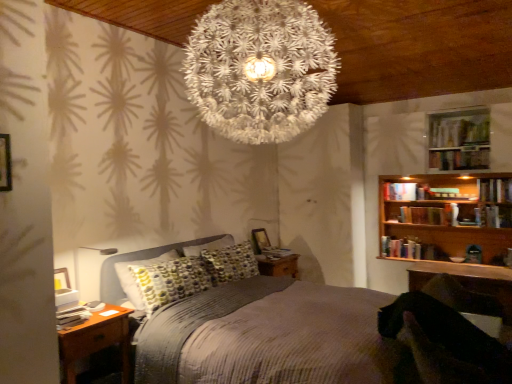
Question: Is brown wood nightstand at lower left positioned with its back to hardcover book at upper right, the first book when ordered from top to bottom?

Choices:
 (A) no
 (B) yes

Answer: (A)

Question: From the image's perspective, is brown wood nightstand at lower left under hardcover book at upper right, the first book when ordered from top to bottom?

Choices:
 (A) yes
 (B) no

Answer: (A)

Question: Considering the relative sizes of brown wood nightstand at lower left and hardcover book at upper right, the sixth book in the bottom-to-top sequence, in the image provided, is brown wood nightstand at lower left bigger than hardcover book at upper right, the sixth book in the bottom-to-top sequence,?

Choices:
 (A) yes
 (B) no

Answer: (A)

Question: From the image's perspective, would you say brown wood nightstand at lower left is positioned over hardcover book at upper right, the sixth book in the bottom-to-top sequence?

Choices:
 (A) yes
 (B) no

Answer: (B)

Question: Is brown wood nightstand at lower left positioned far away from hardcover book at upper right, the 5th book when ordered from left to right?

Choices:
 (A) yes
 (B) no

Answer: (A)

Question: Does point (499, 188) appear closer or farther from the camera than point (461, 157)?

Choices:
 (A) farther
 (B) closer

Answer: (A)

Question: From the image's perspective, is hardcover book at upper right, which is the first book from right to left, above or below hardcover book at upper right, the first book when ordered from top to bottom?

Choices:
 (A) above
 (B) below

Answer: (B)

Question: In terms of width, does hardcover book at upper right, the second book positioned from the top, look wider or thinner when compared to hardcover book at upper right, the 5th book when ordered from left to right?

Choices:
 (A) thin
 (B) wide

Answer: (B)

Question: From a real-world perspective, is hardcover book at upper right, which is the first book from right to left, above or below hardcover book at upper right, the first book when ordered from top to bottom?

Choices:
 (A) above
 (B) below

Answer: (B)

Question: Relative to hardcover book at center, which appears as the sixth book when viewed from the top, is hardcover books at right, which is the second book from bottom to top, in front or behind?

Choices:
 (A) front
 (B) behind

Answer: (B)

Question: From a real-world perspective, is hardcover books at right, marked as the fourth book in a right-to-left arrangement, above or below hardcover book at center, which ranks as the sixth book in right-to-left order?

Choices:
 (A) above
 (B) below

Answer: (B)

Question: From the image's perspective, is hardcover books at right, positioned as the 3th book in left-to-right order, positioned above or below hardcover book at center, the first book from the bottom?

Choices:
 (A) above
 (B) below

Answer: (A)

Question: From their relative heights in the image, would you say hardcover books at right, positioned as the 3th book in left-to-right order, is taller or shorter than hardcover book at center, which appears as the sixth book when viewed from the top?

Choices:
 (A) short
 (B) tall

Answer: (B)

Question: Considering the positions of wooden table at lower right and hardcover book at upper right, which is the first book from right to left, in the image, is wooden table at lower right taller or shorter than hardcover book at upper right, which is the first book from right to left,?

Choices:
 (A) short
 (B) tall

Answer: (B)

Question: Based on their sizes in the image, would you say wooden table at lower right is bigger or smaller than hardcover book at upper right, the fifth book in the bottom-to-top sequence?

Choices:
 (A) big
 (B) small

Answer: (A)